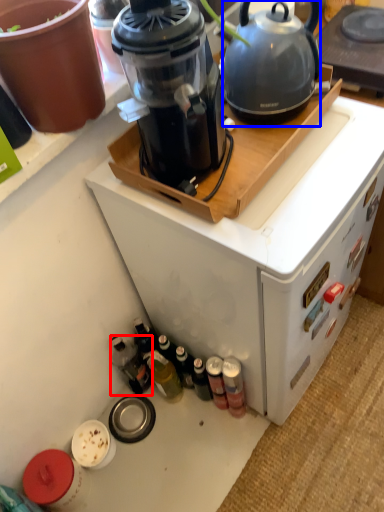
Question: Among these objects, which one is nearest to the camera, bottle (highlighted by a red box) or kettle (highlighted by a blue box)?

Choices:
 (A) bottle
 (B) kettle

Answer: (B)